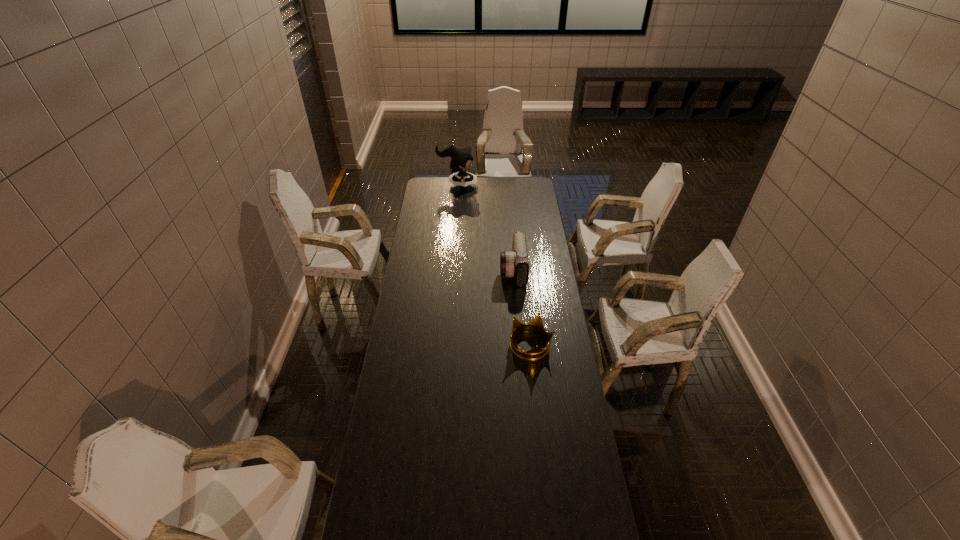
You are a GUI agent. You are given a task and a screenshot of the screen. Output one action in this format:
    pyautogui.click(x=<x>, y=<y>)
    Task: Click on the tallest object
    The height and width of the screenshot is (540, 960).
    Given the screenshot: What is the action you would take?
    pyautogui.click(x=461, y=159)

The width and height of the screenshot is (960, 540). In order to click on the leftmost object in this screenshot , I will do `click(461, 159)`.

You are a GUI agent. You are given a task and a screenshot of the screen. Output one action in this format:
    pyautogui.click(x=<x>, y=<y>)
    Task: Click on the camcorder
    
    Given the screenshot: What is the action you would take?
    pyautogui.click(x=514, y=263)

Where is `the second tallest object`? This screenshot has width=960, height=540. the second tallest object is located at coordinates (514, 263).

Locate an element on the screen. The width and height of the screenshot is (960, 540). crown is located at coordinates point(536,324).

In order to click on the nearest object in this screenshot , I will do `click(536, 324)`.

Find the location of `free space located at the face of the farthest object`. free space located at the face of the farthest object is located at coordinates (497, 185).

Where is `blank space located on the surface of the camcorder`? This screenshot has width=960, height=540. blank space located on the surface of the camcorder is located at coordinates tap(467, 270).

You are a GUI agent. You are given a task and a screenshot of the screen. Output one action in this format:
    pyautogui.click(x=<x>, y=<y>)
    Task: Click on the vacant space situated on the surface of the camcorder
    This screenshot has height=540, width=960.
    Given the screenshot: What is the action you would take?
    pyautogui.click(x=437, y=270)

The height and width of the screenshot is (540, 960). What are the coordinates of `vacant space located 0.090m on the surface of the camcorder` in the screenshot? It's located at (482, 270).